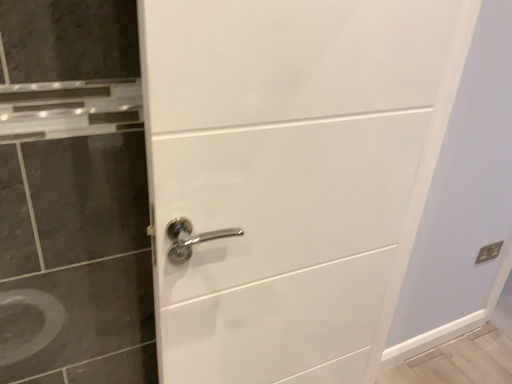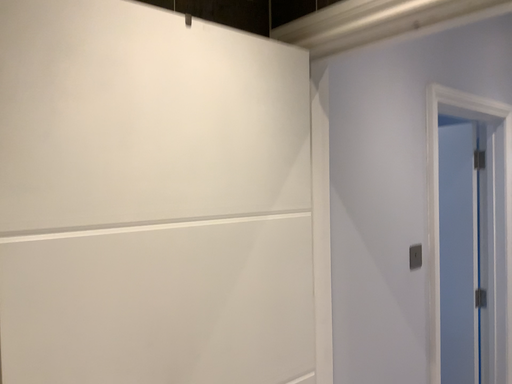
Question: Which way did the camera rotate in the video?

Choices:
 (A) rotated right
 (B) rotated left

Answer: (A)